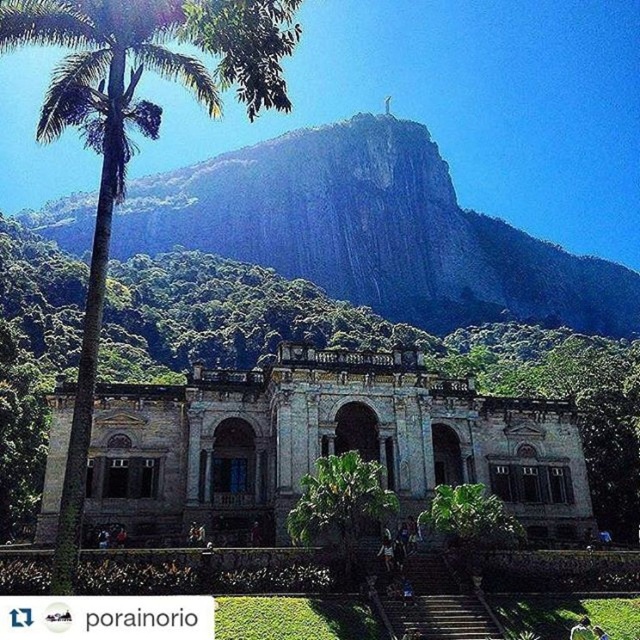
You are planning a guided tour for visitors and want to highlight the proximity of the weathered stone palace at center to the rugged stone mountain at upper center. Based on the scene, can you estimate how far apart these two landmarks are?

The distance between the weathered stone palace at center and the rugged stone mountain at upper center is 732.18 feet.

From the picture: You are standing in front of the grand historical building and want to take a photo. You notice two points marked in the scene. The first point is at coordinates point (468, 262) and the second is at point (292, 525). Which point is closer to your camera position?

Point (292, 525) is closer to the camera position because it is less further than point (468, 262).

You are an architect evaluating the proportions of the weathered stone palace at center and the rugged stone mountain at upper center in the image. Which structure is narrower?

The weathered stone palace at center is narrower than the rugged stone mountain at upper center, as it has a lesser width according to the description.